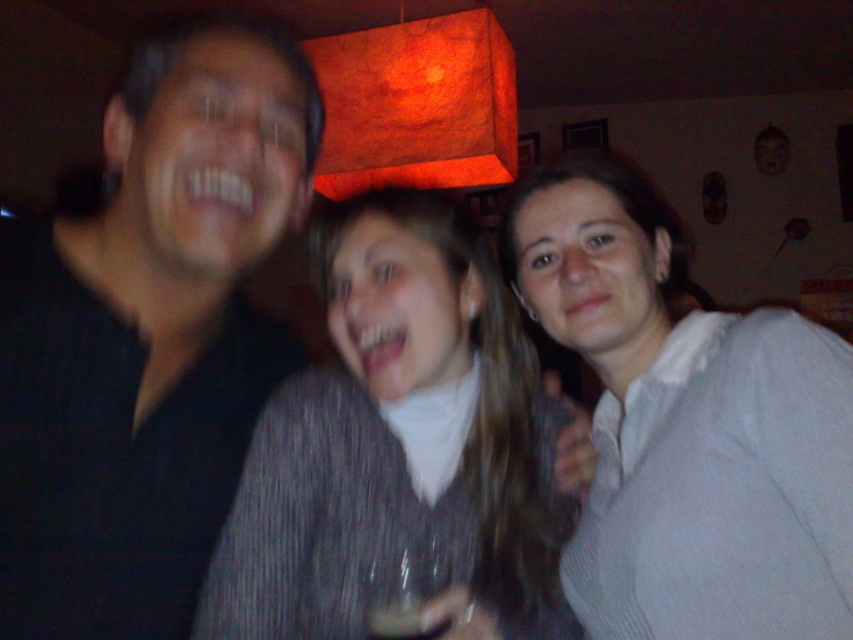
Question: Which point is farther to the camera?

Choices:
 (A) white textured shirt at center
 (B) translucent glass wine at center

Answer: (A)

Question: Which of the following is the closest to the observer?

Choices:
 (A) (408, 636)
 (B) (289, 426)

Answer: (A)

Question: From the image, what is the correct spatial relationship of striped sweater at center in relation to transparent plastic wine glass at lower center?

Choices:
 (A) left
 (B) right

Answer: (B)

Question: Can you confirm if black matte shirt at left is positioned to the right of white textured shirt at center?

Choices:
 (A) no
 (B) yes

Answer: (A)

Question: Can you confirm if striped sweater at center is thinner than transparent plastic wine glass at lower center?

Choices:
 (A) no
 (B) yes

Answer: (A)

Question: Which of the following is the closest to the observer?

Choices:
 (A) striped sweater at center
 (B) black matte shirt at left
 (C) transparent plastic wine glass at lower center
 (D) translucent glass wine at center

Answer: (D)